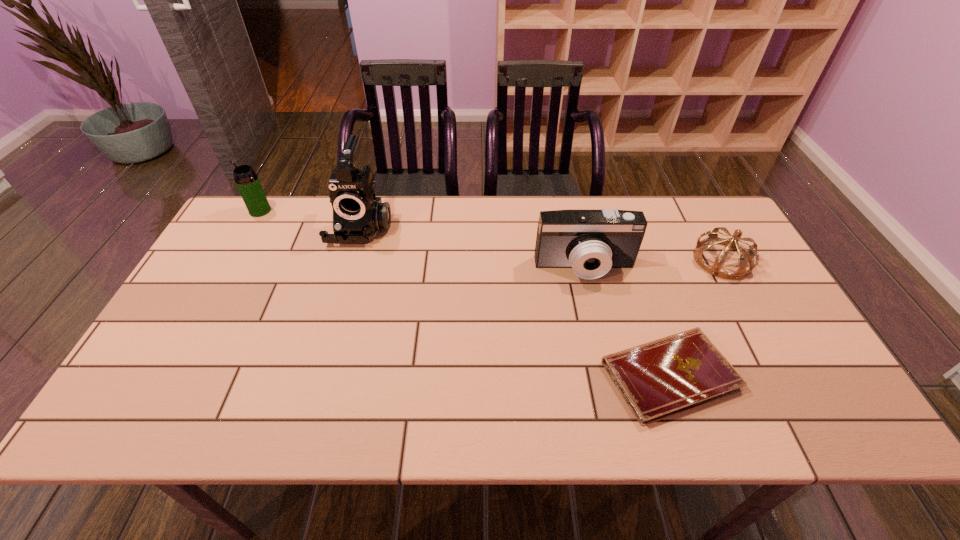
Identify the location of the taller camcorder. (358, 216).

This screenshot has width=960, height=540. I want to click on the tallest object, so click(358, 216).

Identify the location of thermos bottle. (247, 181).

Image resolution: width=960 pixels, height=540 pixels. What are the coordinates of `the nearer camcorder` in the screenshot? It's located at (591, 242).

Locate an element on the screen. This screenshot has width=960, height=540. the right camcorder is located at coordinates (591, 242).

Where is `tiara`? tiara is located at coordinates (745, 255).

At what (x,y) coordinates should I click in order to perform the action: click on the rightmost object. Please return your answer as a coordinate pair (x, y). Looking at the image, I should click on (745, 255).

This screenshot has width=960, height=540. Find the location of `the nearest object`. the nearest object is located at coordinates (659, 379).

Locate an element on the screen. The height and width of the screenshot is (540, 960). notebook is located at coordinates (659, 379).

Locate an element on the screen. The image size is (960, 540). blank space located 0.260m on the lens mount of the taller camcorder is located at coordinates (335, 316).